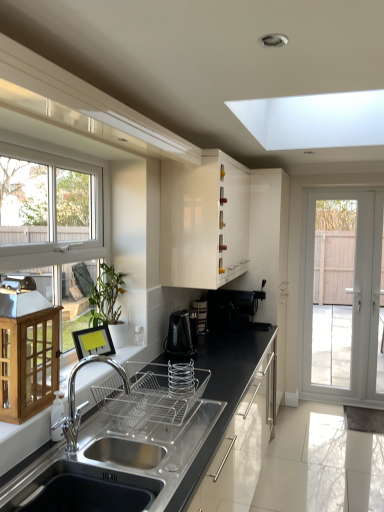
Measure the distance between point (x=73, y=410) and camera.

1.68 meters.

The width and height of the screenshot is (384, 512). What do you see at coordinates (106, 296) in the screenshot?
I see `green matte plant at upper left` at bounding box center [106, 296].

This screenshot has height=512, width=384. What do you see at coordinates (203, 223) in the screenshot?
I see `white glossy cabinet at upper center, the 1th cabinetry when ordered from back to front` at bounding box center [203, 223].

In order to face white glossy door at right, should I rotate leftwards or rightwards?

Turn right approximately 20.744 degrees to face it.

Identify the location of satin black countertop at lower center. (223, 388).

Measure the distance between white glossy screen door at right and camera.

white glossy screen door at right is 3.91 meters away from camera.

At what (x,y) coordinates should I click in order to perform the action: click on black plastic coffee maker at upper right, which appears as the 1th appliance when viewed from the back. Please return your answer as a coordinate pair (x, y). The image size is (384, 512). Looking at the image, I should click on (232, 308).

Is white glossy cabinet at upper center, the 1th cabinetry when ordered from back to front, inside the boundaries of wooden cabinet at left, placed as the 1th cabinetry when sorted from bottom to top, or outside?

white glossy cabinet at upper center, the 1th cabinetry when ordered from back to front, exists outside the volume of wooden cabinet at left, placed as the 1th cabinetry when sorted from bottom to top.

Considering the positions of point (167, 272) and point (4, 293), is point (167, 272) closer or farther from the camera than point (4, 293)?

Clearly, point (167, 272) is more distant from the camera than point (4, 293).

Is wooden cabinet at left, marked as the second cabinetry in a back-to-front arrangement, at the back of white glossy cabinet at upper center, the second cabinetry when ordered from left to right?

No, white glossy cabinet at upper center, the second cabinetry when ordered from left to right, is not facing away from wooden cabinet at left, marked as the second cabinetry in a back-to-front arrangement.

Is white glossy cabinet at upper center, which is the 2th cabinetry in front-to-back order, wider than wooden cabinet at left, placed as the 1th cabinetry when sorted from bottom to top?

Yes, white glossy cabinet at upper center, which is the 2th cabinetry in front-to-back order, is wider than wooden cabinet at left, placed as the 1th cabinetry when sorted from bottom to top.

Considering the sizes of objects white glossy screen door at right and white glossy cabinet at upper center, which is the 1th cabinetry in right-to-left order, in the image provided, who is shorter, white glossy screen door at right or white glossy cabinet at upper center, which is the 1th cabinetry in right-to-left order,?

white glossy cabinet at upper center, which is the 1th cabinetry in right-to-left order.

Does white glossy screen door at right appear on the right side of white glossy cabinet at upper center, the second cabinetry when ordered from left to right?

Yes.

Does white glossy screen door at right have a lesser width compared to white glossy cabinet at upper center, which is the 2th cabinetry in front-to-back order?

Yes.

From the image's perspective, which object appears higher, clear plastic dish rack at center, the first appliance when ordered from front to back, or chrome metallic tap at sink left?

From the image's view, chrome metallic tap at sink left is above.

Is clear plastic dish rack at center, the 4th appliance in the back-to-front sequence, further to the viewer compared to chrome metallic tap at sink left?

Yes, clear plastic dish rack at center, the 4th appliance in the back-to-front sequence, is further from the camera.

Is white glossy cabinet at upper center, the 1th cabinetry when ordered from back to front, completely or partially outside of white glossy door at right?

Yes, white glossy cabinet at upper center, the 1th cabinetry when ordered from back to front, is not within white glossy door at right.

From the picture: Can you confirm if white glossy cabinet at upper center, which is the 2th cabinetry in front-to-back order, is bigger than white glossy door at right?

Indeed, white glossy cabinet at upper center, which is the 2th cabinetry in front-to-back order, has a larger size compared to white glossy door at right.

Between white glossy cabinet at upper center, which ranks as the 2th cabinetry in bottom-to-top order, and white glossy door at right, which one has more height?

white glossy door at right.

Image resolution: width=384 pixels, height=512 pixels. Find the location of `plant behind the satin black countertop at lower center`. plant behind the satin black countertop at lower center is located at coordinates (106, 296).

Who is smaller, satin black countertop at lower center or green matte plant at upper left?

Smaller between the two is green matte plant at upper left.

What's the angular difference between satin black countertop at lower center and green matte plant at upper left's facing directions?

There is a 1.42-degree angle between the facing directions of satin black countertop at lower center and green matte plant at upper left.

Which object is more forward, black plastic coffee maker at upper right, positioned as the 4th appliance in front-to-back order, or green matte plant at upper left?

green matte plant at upper left is more forward.

Can you confirm if black plastic coffee maker at upper right, positioned as the 4th appliance in front-to-back order, is positioned to the right of green matte plant at upper left?

Correct, you'll find black plastic coffee maker at upper right, positioned as the 4th appliance in front-to-back order, to the right of green matte plant at upper left.

Find the location of a particular element. The width and height of the screenshot is (384, 512). plant on the left of black plastic coffee maker at upper right, which appears as the 1th appliance when viewed from the back is located at coordinates (106, 296).

Looking at their sizes, would you say black plastic coffee maker at upper right, positioned as the 4th appliance in front-to-back order, is wider or thinner than green matte plant at upper left?

In the image, black plastic coffee maker at upper right, positioned as the 4th appliance in front-to-back order, appears to be wider than green matte plant at upper left.

Who is shorter, black glossy electric kettle at center, the 2th appliance when ordered from front to back, or black plastic coffee maker at upper right, which appears as the 1th appliance when viewed from the back?

Standing shorter between the two is black glossy electric kettle at center, the 2th appliance when ordered from front to back.

Considering the relative sizes of black glossy electric kettle at center, the 2th appliance when ordered from front to back, and black plastic coffee maker at upper right, positioned as the 4th appliance in front-to-back order, in the image provided, is black glossy electric kettle at center, the 2th appliance when ordered from front to back, thinner than black plastic coffee maker at upper right, positioned as the 4th appliance in front-to-back order,?

Correct, the width of black glossy electric kettle at center, the 2th appliance when ordered from front to back, is less than that of black plastic coffee maker at upper right, positioned as the 4th appliance in front-to-back order.

Which is in front, point (180, 344) or point (220, 292)?

The point (180, 344) is closer to the camera.

From the image's perspective, is black glossy electric kettle at center, which is the third appliance in back-to-front order, on black plastic coffee maker at upper right, which appears as the 1th appliance when viewed from the back?

No.

Where is `cabinetry in front of the white glossy cabinet at upper center, which is the 2th cabinetry in front-to-back order`? Image resolution: width=384 pixels, height=512 pixels. cabinetry in front of the white glossy cabinet at upper center, which is the 2th cabinetry in front-to-back order is located at coordinates (27, 354).

Where is `cabinetry that is the 1st one when counting leftward from the white glossy screen door at right`? The height and width of the screenshot is (512, 384). cabinetry that is the 1st one when counting leftward from the white glossy screen door at right is located at coordinates (203, 223).

When comparing their distances from chrome metallic tap at sink left, does white glossy cabinet at upper center, which is the 1th cabinetry in top-to-bottom order, or green matte plant at upper left seem closer?

green matte plant at upper left.

Based on their spatial positions, is white glossy door at right or chrome metallic tap at sink left closer to white glossy screen door at right?

white glossy door at right.

In the scene shown: Considering their positions, is white glossy cabinet at upper center, which is the 1th cabinetry in right-to-left order, positioned closer to satin black countertop at lower center than black plastic coffee maker at upper right, positioned as the 4th appliance in front-to-back order?

Based on the image, black plastic coffee maker at upper right, positioned as the 4th appliance in front-to-back order, appears to be nearer to satin black countertop at lower center.

Estimate the real-world distances between objects in this image. Which object is further from green matte plant at upper left, satin black countertop at lower center or satin black kettle at center, the third appliance positioned from the front?

Based on the image, satin black kettle at center, the third appliance positioned from the front, appears to be further to green matte plant at upper left.

Consider the image. Estimate the real-world distances between objects in this image. Which object is further from satin black countertop at lower center, green matte plant at upper left or chrome metallic tap at sink left?

The object further to satin black countertop at lower center is green matte plant at upper left.

Looking at this image, estimate the real-world distances between objects in this image. Which object is further from white glossy door at right, white glossy cabinet at upper center, the 1th cabinetry when ordered from back to front, or clear plastic dish rack at center, the 4th appliance in the back-to-front sequence?

clear plastic dish rack at center, the 4th appliance in the back-to-front sequence, is further to white glossy door at right.

Considering their positions, is wooden cabinet at left, positioned as the first cabinetry in left-to-right order, positioned closer to white glossy door at right than black glossy electric kettle at center, which is the third appliance in back-to-front order?

Among the two, black glossy electric kettle at center, which is the third appliance in back-to-front order, is located nearer to white glossy door at right.

Considering their positions, is satin black kettle at center, which is the 2th appliance from back to front, positioned closer to chrome metallic tap at sink left than green matte plant at upper left?

green matte plant at upper left is positioned closer to the anchor chrome metallic tap at sink left.

I want to click on door positioned between chrome metallic tap at sink left and white glossy screen door at right from near to far, so click(x=344, y=304).

At what (x,y) coordinates should I click in order to perform the action: click on appliance situated between satin black kettle at center, which is the 2th appliance from back to front, and white glossy screen door at right from left to right. Please return your answer as a coordinate pair (x, y). The height and width of the screenshot is (512, 384). Looking at the image, I should click on (232, 308).

This screenshot has width=384, height=512. Find the location of `cabinetry between clear plastic dish rack at center, the first appliance when ordered from front to back, and black glossy electric kettle at center, the 2th appliance when ordered from front to back, in the front-back direction`. cabinetry between clear plastic dish rack at center, the first appliance when ordered from front to back, and black glossy electric kettle at center, the 2th appliance when ordered from front to back, in the front-back direction is located at coordinates (203, 223).

At what (x,y) coordinates should I click in order to perform the action: click on cabinetry between green matte plant at upper left and satin black kettle at center, which is the 2th appliance from back to front, from front to back. Please return your answer as a coordinate pair (x, y). The image size is (384, 512). Looking at the image, I should click on (203, 223).